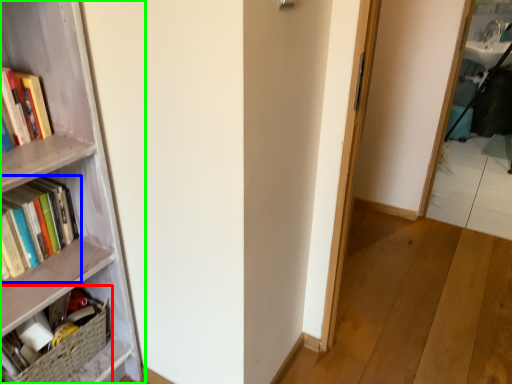
Question: Which object is the farthest from book (highlighted by a red box)? Choose among these: book (highlighted by a blue box) or bookcase (highlighted by a green box).

Choices:
 (A) book
 (B) bookcase

Answer: (A)